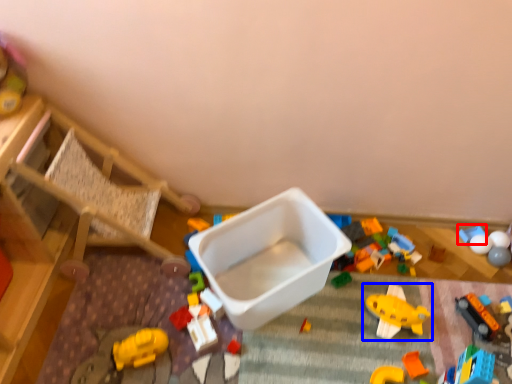
Question: Which object is closer to the camera taking this photo, toy (highlighted by a red box) or toy (highlighted by a blue box)?

Choices:
 (A) toy
 (B) toy

Answer: (B)